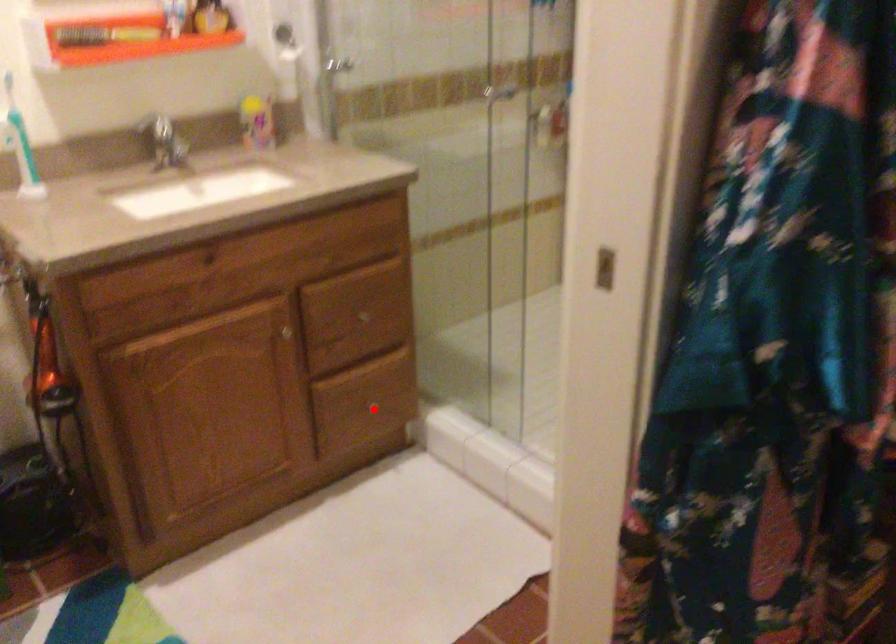
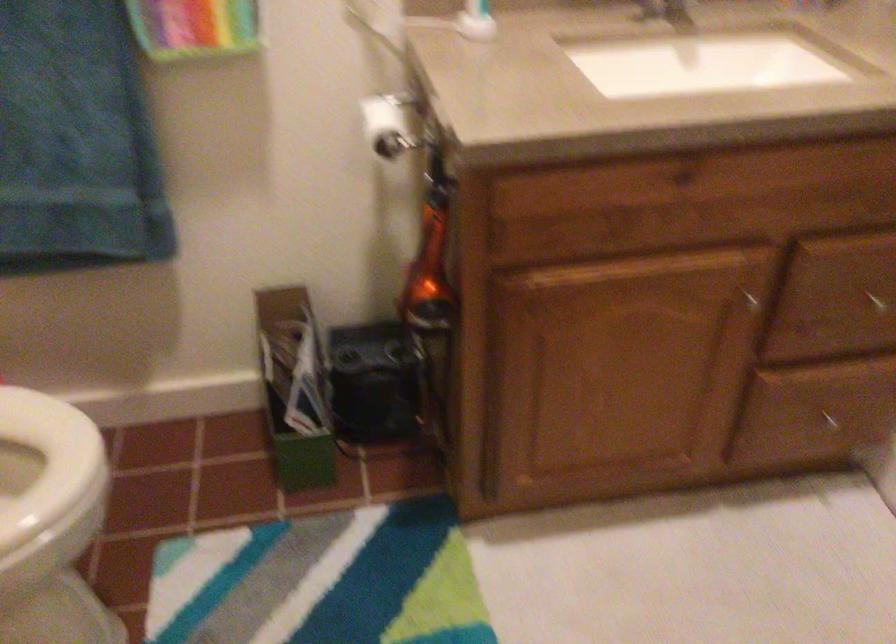
Locate, in the second image, the point that corresponds to the highlighted location in the first image.

(831, 422)